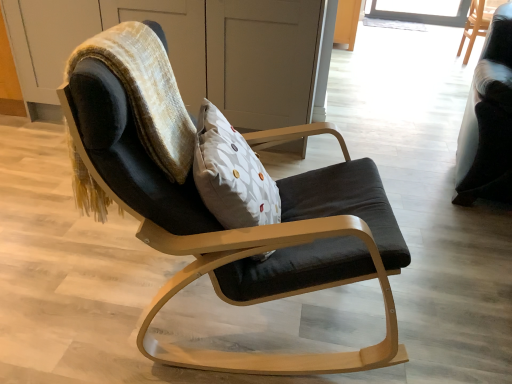
Question: From a real-world perspective, is white dotted pillow at center located beneath velvet black chair at center, which is the 3th chair in right-to-left order?

Choices:
 (A) yes
 (B) no

Answer: (B)

Question: Can you confirm if white dotted pillow at center is bigger than velvet black chair at center, which is the 3th chair in right-to-left order?

Choices:
 (A) no
 (B) yes

Answer: (A)

Question: Is white dotted pillow at center with velvet black chair at center, marked as the third chair in a back-to-front arrangement?

Choices:
 (A) yes
 (B) no

Answer: (B)

Question: From the image's perspective, is white dotted pillow at center beneath velvet black chair at center, the first chair from the front?

Choices:
 (A) yes
 (B) no

Answer: (B)

Question: Is white dotted pillow at center positioned far away from velvet black chair at center, marked as the third chair in a back-to-front arrangement?

Choices:
 (A) yes
 (B) no

Answer: (B)

Question: Does white dotted pillow at center lie behind velvet black chair at center, marked as the first chair in a left-to-right arrangement?

Choices:
 (A) yes
 (B) no

Answer: (A)

Question: Is matte wood dresser at center bigger than black fabric chair at upper right, the first chair in the right-to-left sequence?

Choices:
 (A) no
 (B) yes

Answer: (B)

Question: Is matte wood dresser at center oriented away from black fabric chair at upper right, positioned as the third chair in left-to-right order?

Choices:
 (A) no
 (B) yes

Answer: (A)

Question: From the image's perspective, is matte wood dresser at center on black fabric chair at upper right, which appears as the 1th chair when viewed from the back?

Choices:
 (A) no
 (B) yes

Answer: (A)

Question: From a real-world perspective, is matte wood dresser at center positioned under black fabric chair at upper right, positioned as the third chair in left-to-right order, based on gravity?

Choices:
 (A) no
 (B) yes

Answer: (A)

Question: Considering the relative sizes of matte wood dresser at center and black fabric chair at upper right, which appears as the 1th chair when viewed from the back, in the image provided, is matte wood dresser at center taller than black fabric chair at upper right, which appears as the 1th chair when viewed from the back,?

Choices:
 (A) yes
 (B) no

Answer: (A)

Question: Is matte wood dresser at center placed right next to black fabric chair at upper right, positioned as the 3th chair in front-to-back order?

Choices:
 (A) no
 (B) yes

Answer: (A)

Question: From the image's perspective, is matte wood dresser at center beneath velvet black bean bag chair at upper left?

Choices:
 (A) yes
 (B) no

Answer: (B)